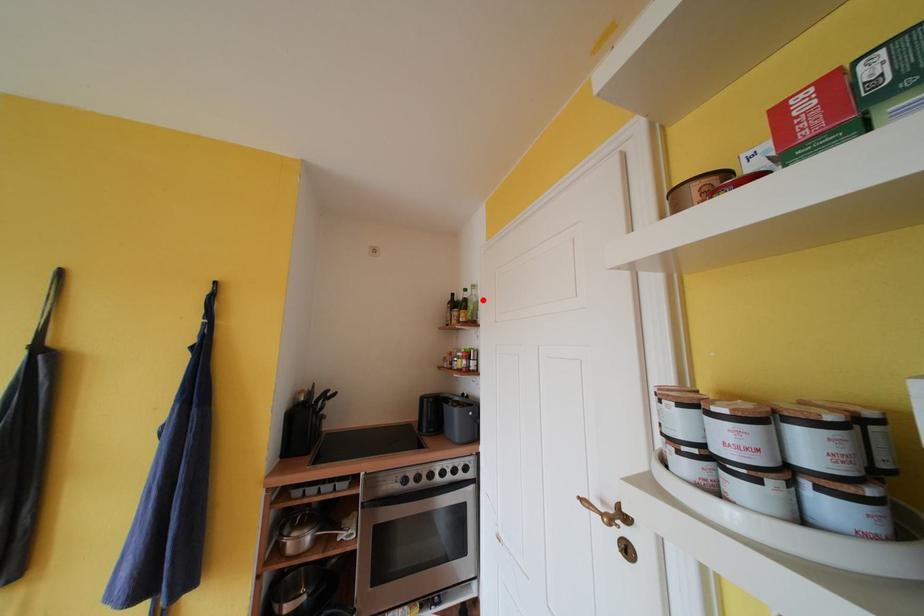
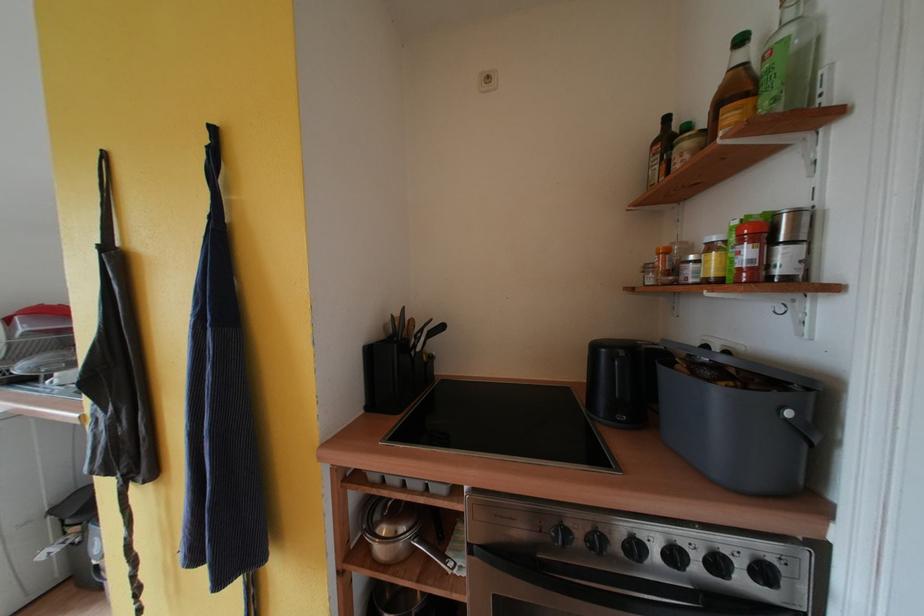
Locate, in the second image, the point that corresponds to the highlighted location in the first image.

(817, 28)